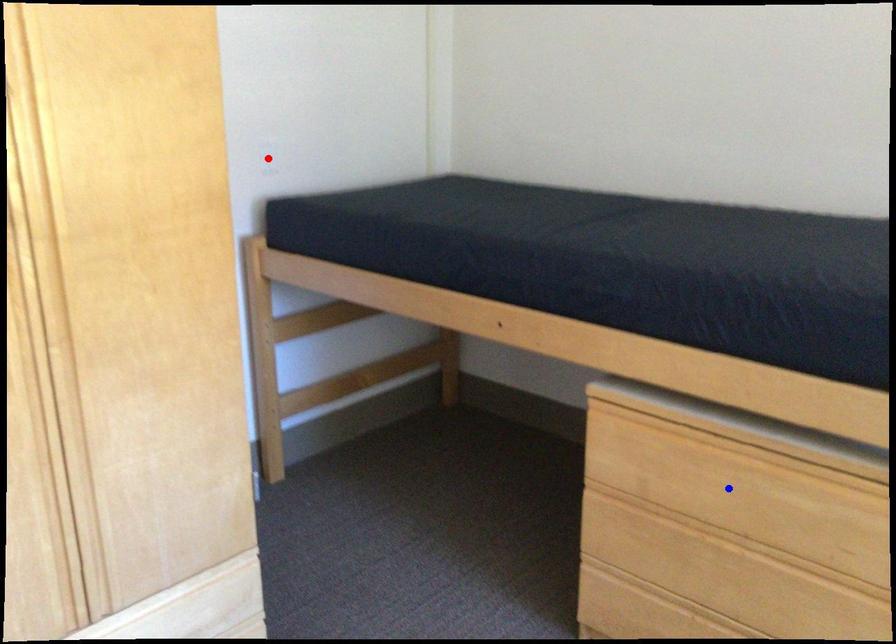
Question: Which of the two points in the image is closer to the camera?

Choices:
 (A) Blue point is closer.
 (B) Red point is closer.

Answer: (A)